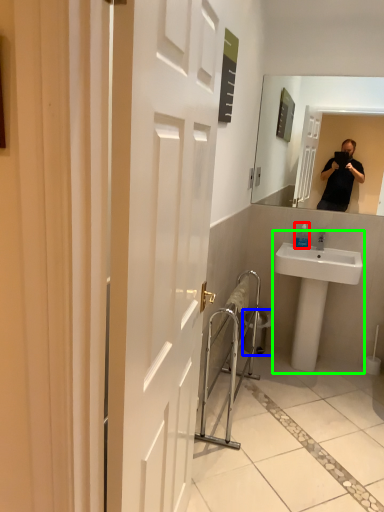
Question: Which object is positioned farthest from bottle (highlighted by a red box)? Select from trash bin/can (highlighted by a blue box) and sink (highlighted by a green box).

Choices:
 (A) trash bin/can
 (B) sink

Answer: (A)